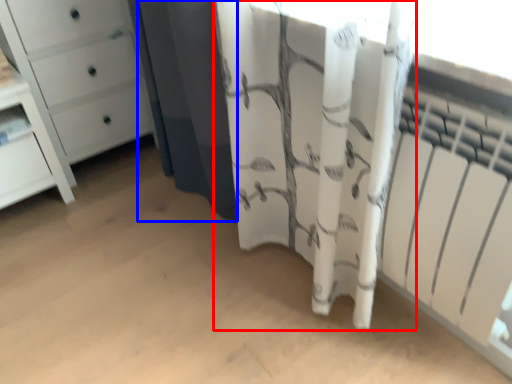
Question: Which object is further to the camera taking this photo, curtain (highlighted by a red box) or shower curtain (highlighted by a blue box)?

Choices:
 (A) curtain
 (B) shower curtain

Answer: (B)